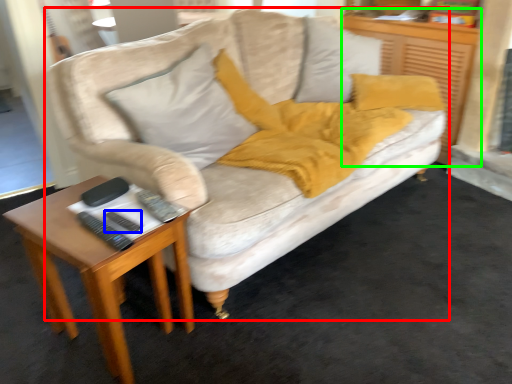
Question: Based on their relative distances, which object is farther from studio couch (highlighted by a red box)? Choose from remote (highlighted by a blue box) and dresser (highlighted by a green box).

Choices:
 (A) remote
 (B) dresser

Answer: (A)